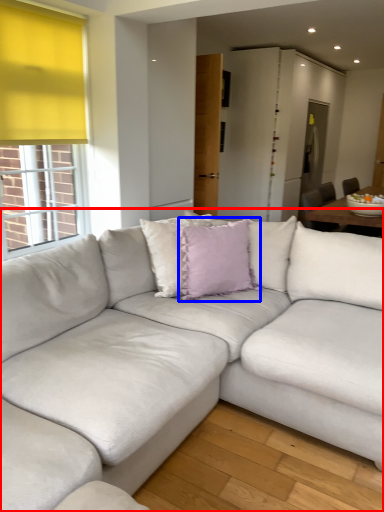
Question: Which of the following is the closest to the observer, studio couch (highlighted by a red box) or pillow (highlighted by a blue box)?

Choices:
 (A) studio couch
 (B) pillow

Answer: (A)